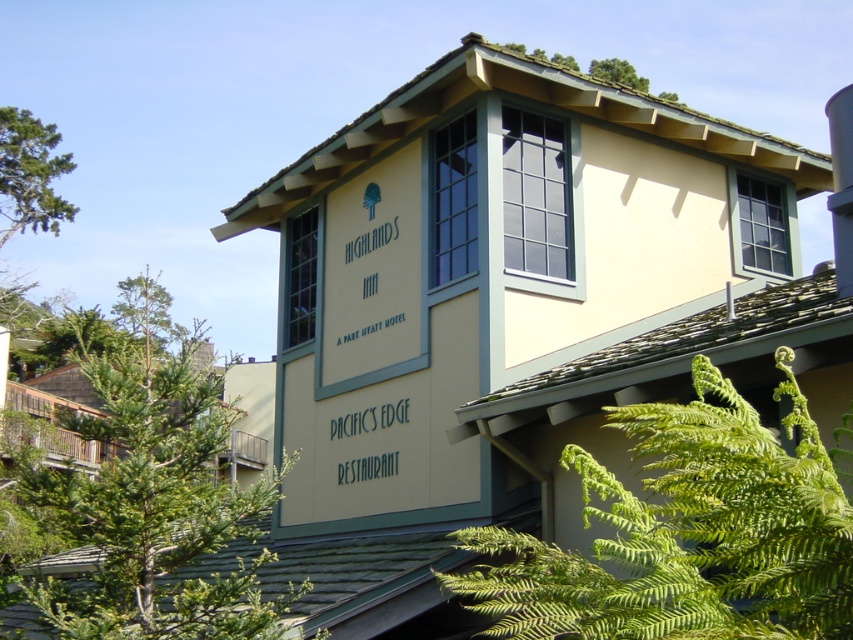
Question: Can you confirm if green leafy fern at lower right is thinner than green leafy tree at center?

Choices:
 (A) no
 (B) yes

Answer: (B)

Question: Which point appears farthest from the camera in this image?

Choices:
 (A) (27, 496)
 (B) (816, 516)
 (C) (538, 58)

Answer: (C)

Question: Is green leafy tree at center above green leafy tree at upper center?

Choices:
 (A) no
 (B) yes

Answer: (A)

Question: Does green leafy fern at lower right appear on the right side of green leafy tree at center?

Choices:
 (A) no
 (B) yes

Answer: (B)

Question: Which object is positioned farthest from the green leafy fern at lower right?

Choices:
 (A) green leafy tree at upper center
 (B) green leafy tree at center

Answer: (A)

Question: Among these objects, which one is farthest from the camera?

Choices:
 (A) green leafy fern at lower right
 (B) green leafy tree at center
 (C) green leafy tree at upper center

Answer: (C)